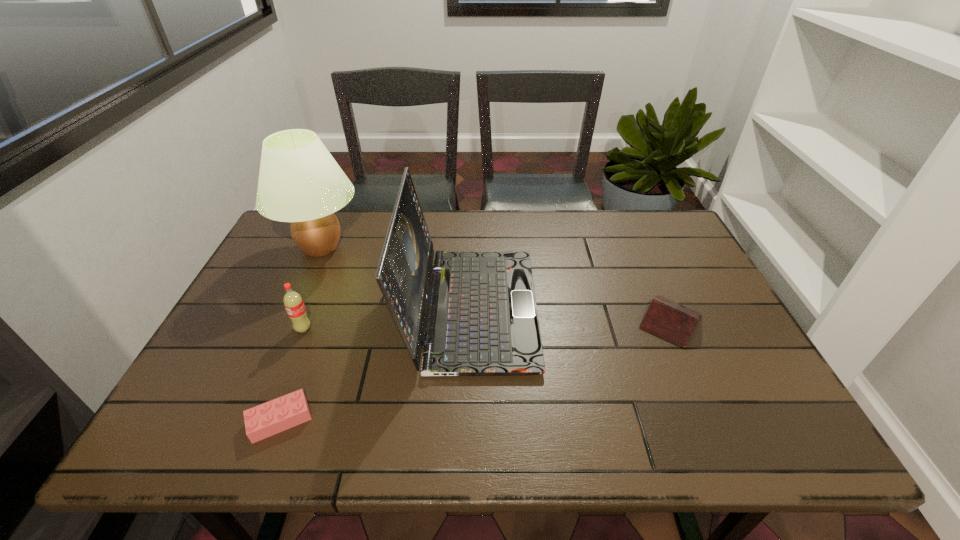
Find the location of a particular element. Image resolution: width=960 pixels, height=540 pixels. free space at the left edge of the desktop is located at coordinates tap(310, 258).

In the image, there is a desktop. At what (x,y) coordinates should I click in order to perform the action: click on free space at the right edge. Please return your answer as a coordinate pair (x, y). Looking at the image, I should click on (709, 394).

Where is `vacant region at the far left corner of the desktop`? This screenshot has width=960, height=540. vacant region at the far left corner of the desktop is located at coordinates (296, 250).

The width and height of the screenshot is (960, 540). Identify the location of vacant space at the near left corner of the desktop. (194, 439).

Find the location of a particular element. Image resolution: width=960 pixels, height=540 pixels. free area in between the nearest object and the fourth shortest object is located at coordinates (375, 364).

Identify the location of vacant point located between the fourth tallest object and the laptop computer. Image resolution: width=960 pixels, height=540 pixels. (571, 315).

Where is `vacant area that lies between the laptop computer and the soda`? vacant area that lies between the laptop computer and the soda is located at coordinates (387, 319).

This screenshot has height=540, width=960. I want to click on vacant space in between the shortest object and the third tallest object, so click(292, 374).

Find the location of a particular element. The height and width of the screenshot is (540, 960). vacant area that lies between the shortest object and the soda is located at coordinates (292, 374).

This screenshot has height=540, width=960. Identify the location of object that is the third closest to the lampshade. (262, 421).